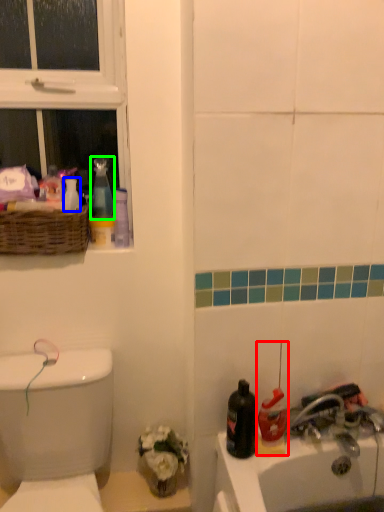
Question: Which is farther away from cleaning product (highlighted by a red box)? toiletry (highlighted by a blue box) or cleaning product (highlighted by a green box)?

Choices:
 (A) toiletry
 (B) cleaning product

Answer: (A)